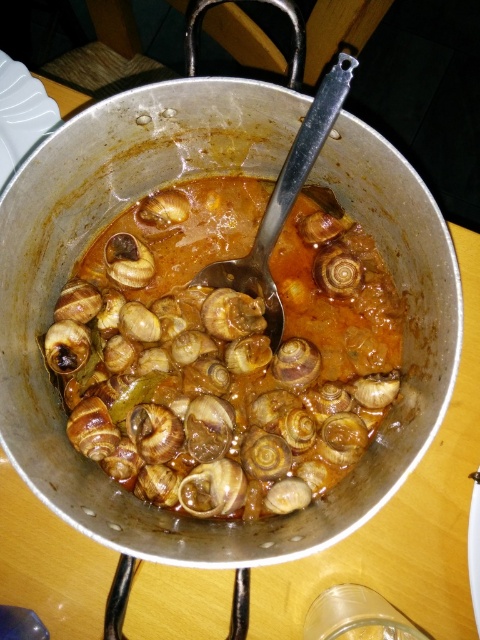
Between point (343, 310) and point (130, 276), which one is positioned behind?

Positioned behind is point (343, 310).

Is point (162, 433) positioned in front of point (116, 237)?

Yes.

This screenshot has width=480, height=640. I want to click on shiny brown snail at center, so click(227, 352).